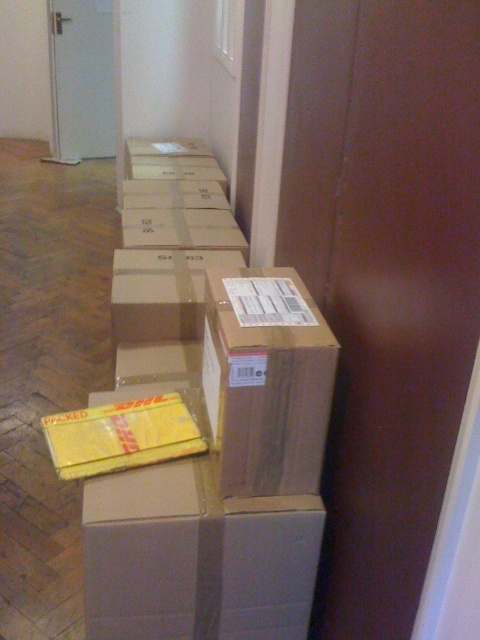
You are standing in the hallway and want to pick up the matte cardboard box at center and the brown cardboard box at center. Which box should you reach for first to avoid having to move the other one?

You should reach for the matte cardboard box at center first because it is closer to you than the brown cardboard box at center, so you can pick it up without needing to move the other one first.

You are trying to retrieve an item from the hallway. You see a matte cardboard box at center and a brown cardboard box at center. Which box should you move first to access the one underneath?

The matte cardboard box at center is positioned under the brown cardboard box at center, so you should move the brown cardboard box at center first to access the one underneath.

You are an inventory manager who needs to stack more boxes on top of the existing ones. Given that the matte cardboard box at center and the brown cardboard box at center are in your way, which box should you move to allow stacking on the taller one?

You should move the matte cardboard box at center because it has a lesser height compared to the brown cardboard box at center, so the brown cardboard box at center is taller and stacking can be done on top of it.